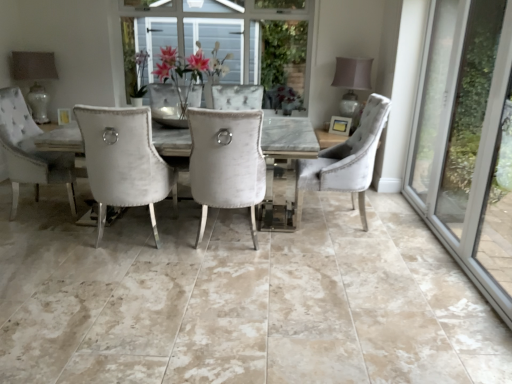
The height and width of the screenshot is (384, 512). Identify the location of vacant area located to the right-hand side of velvet grey chair at right, which ranks as the first chair in right-to-left order. (398, 223).